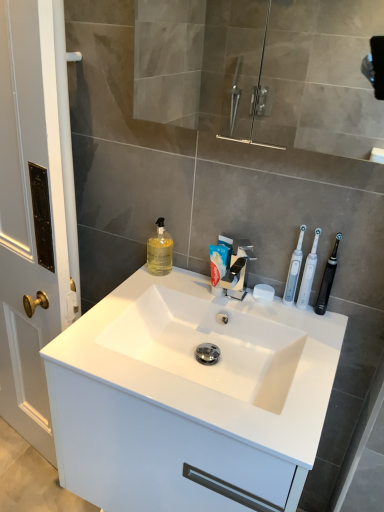
Image resolution: width=384 pixels, height=512 pixels. I want to click on vacant area that lies between white plastic toothbrushes at right, which is the 1th toothbrush in left-to-right order, and polished chrome faucet at center, so click(258, 308).